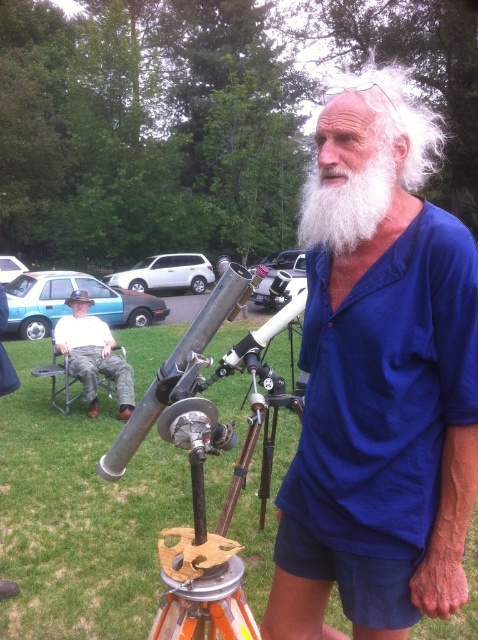
You are a photographer trying to capture a closeup of the polished silver telescope at center and the white curly hair at upper center. Which object should you zoom in on to ensure both are in focus without moving your camera position?

The white curly hair at upper center is larger than the polished silver telescope at center, so you should zoom in on the smaller object, the polished silver telescope at center, to ensure both are in focus.

You are a photographer trying to capture the man in the scene. You want to ensure that both the white curly hair at upper center and the white cotton shirt at lower left are clearly visible in your photo. Considering their sizes, which object should you focus on to ensure both are in frame?

The white curly hair at upper center is much taller than the white cotton shirt at lower left, so focusing on the taller white curly hair at upper center would help ensure both are in frame.